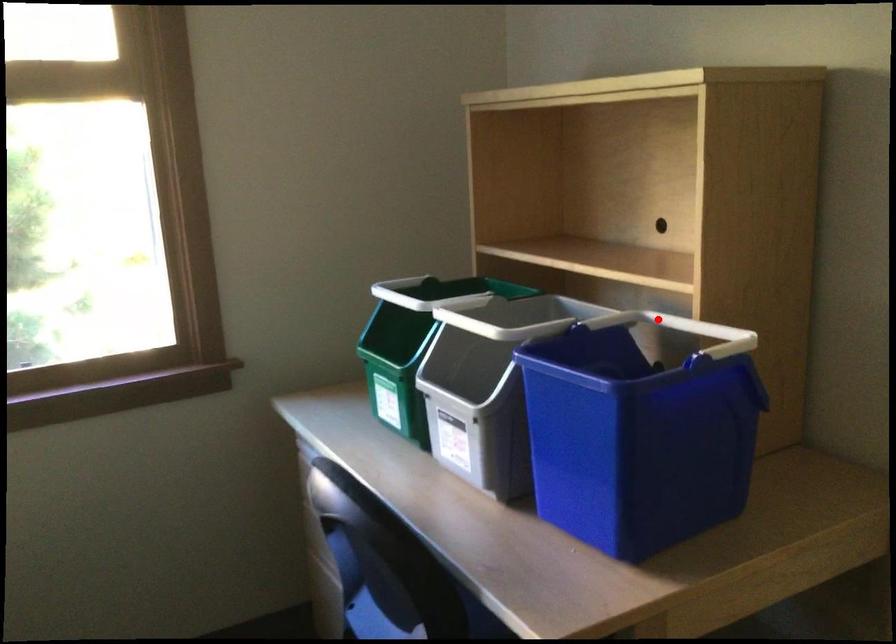
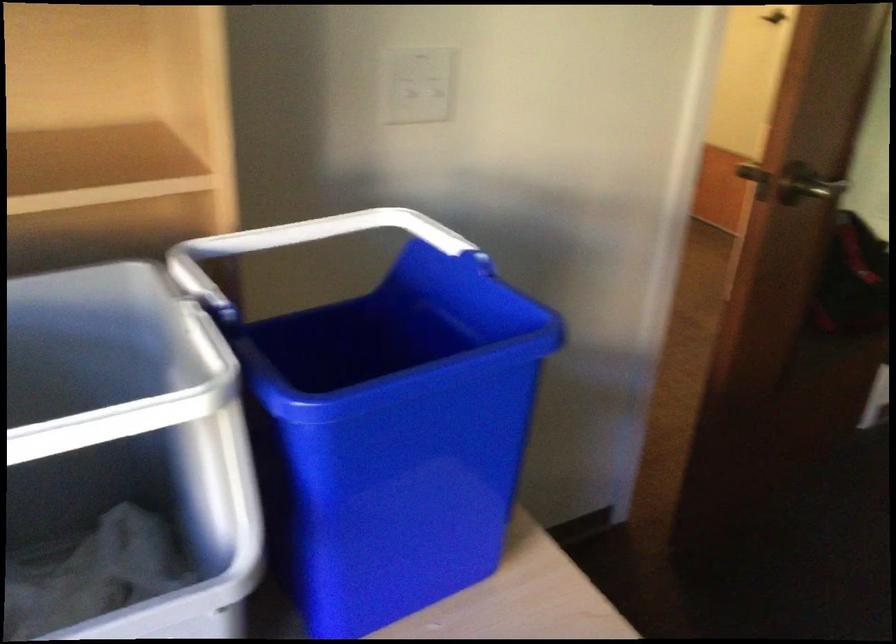
The point at the highlighted location is marked in the first image. Where is the corresponding point in the second image?

(213, 257)